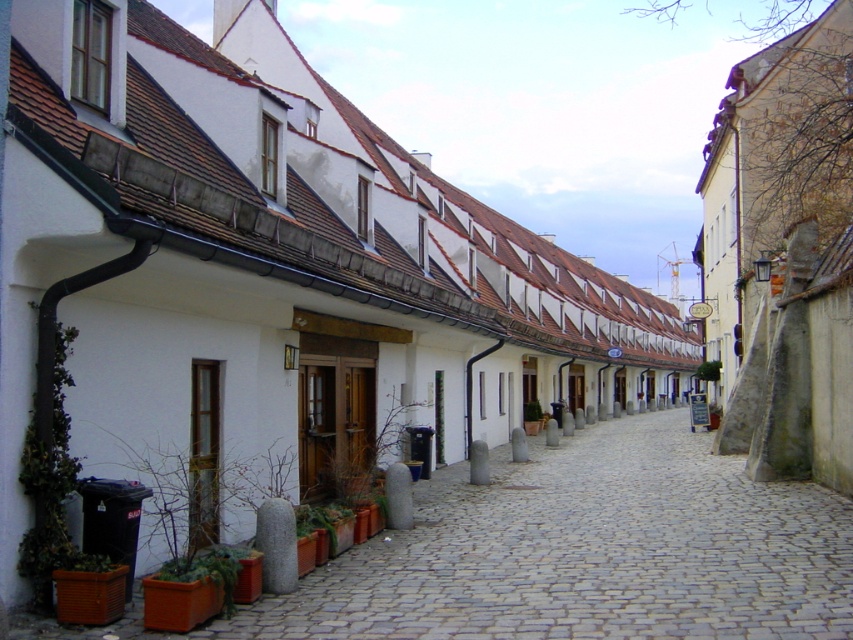
Is smooth stone path at center wider than green leafy plant at center?

Yes, smooth stone path at center is wider than green leafy plant at center.

Who is shorter, smooth stone path at center or green leafy plant at center?

green leafy plant at center

What do you see at coordinates (573, 554) in the screenshot?
I see `smooth stone path at center` at bounding box center [573, 554].

Where is `smooth stone path at center`? The width and height of the screenshot is (853, 640). smooth stone path at center is located at coordinates (573, 554).

The image size is (853, 640). What do you see at coordinates (573, 554) in the screenshot? I see `smooth stone path at center` at bounding box center [573, 554].

Can you confirm if smooth stone path at center is shorter than green matte plant at center?

In fact, smooth stone path at center may be taller than green matte plant at center.

From the picture: Measure the distance between point (439, 486) and camera.

Point (439, 486) and camera are 18.36 meters apart.

Locate an element on the screen. This screenshot has width=853, height=640. smooth stone path at center is located at coordinates (573, 554).

Between point (360, 468) and point (531, 413), which one is positioned in front?

Point (360, 468)

How far apart are green matte plant at center and green leafy plant at center?

They are 19.87 meters apart.

Between point (386, 417) and point (526, 408), which one is positioned in front?

Point (386, 417) is in front.

Identify the location of green matte plant at center. (376, 456).